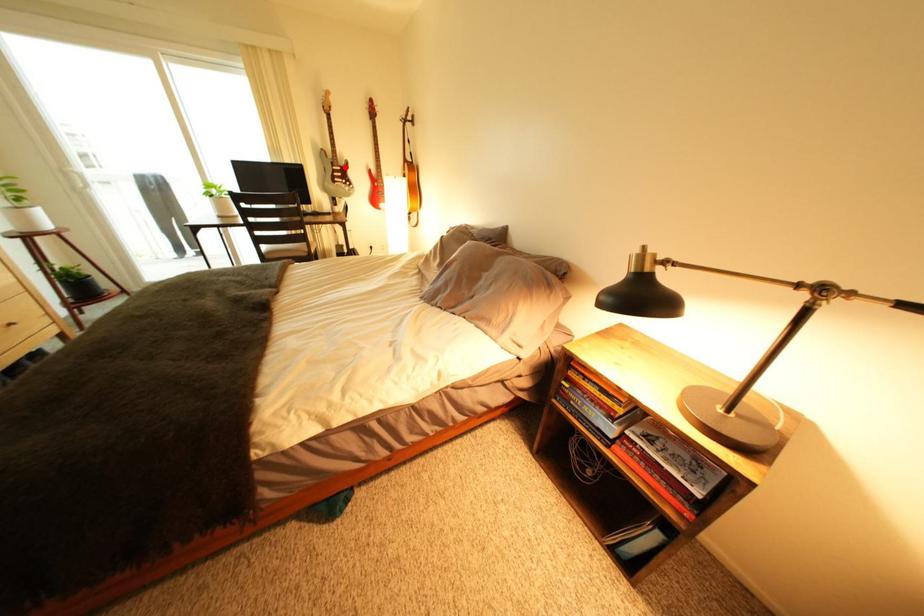
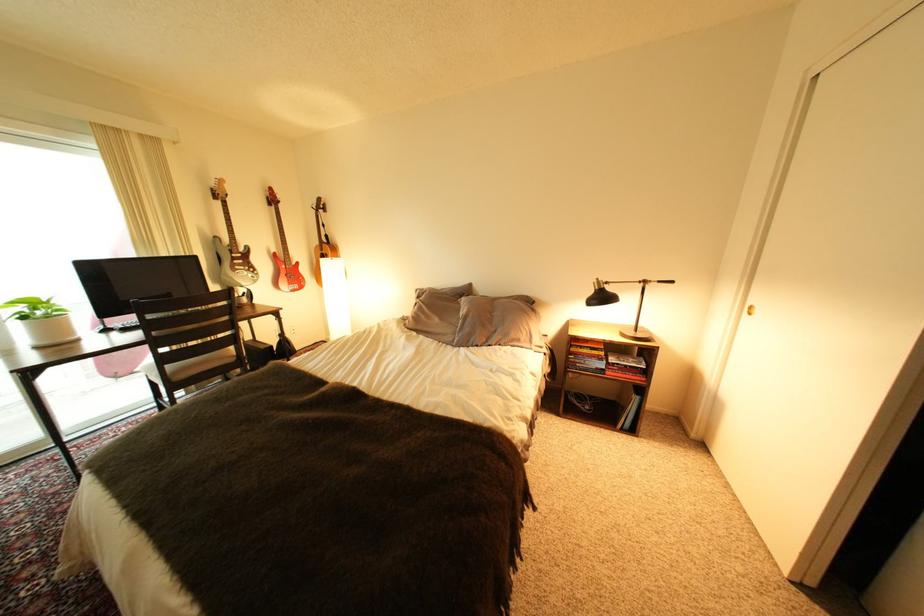
The point at the highlighted location is marked in the first image. Where is the corresponding point in the second image?

(244, 254)